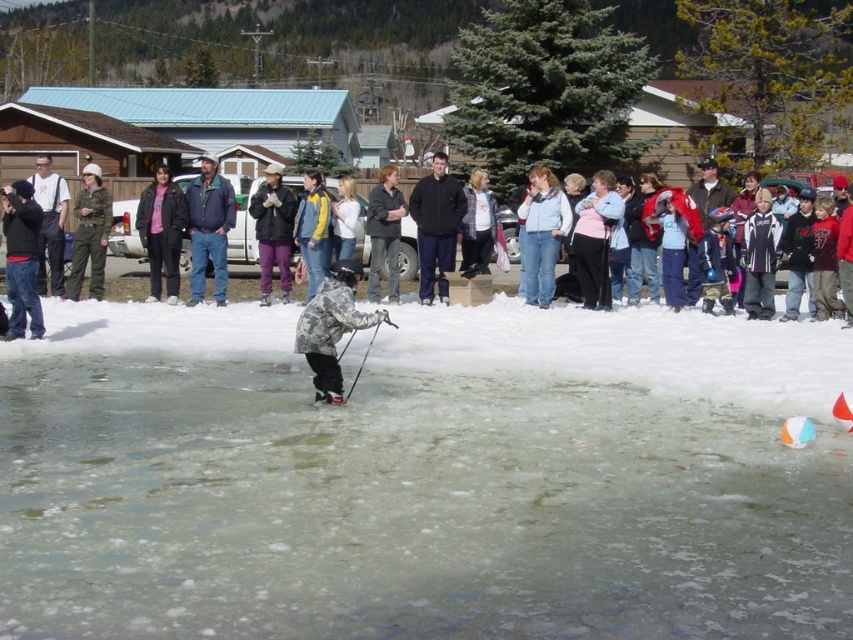
Question: Which object is closer to the camera taking this photo?

Choices:
 (A) dark blue jacket at center
 (B) camouflage snowsuit at center

Answer: (B)

Question: Which of the following is the closest to the observer?

Choices:
 (A) (381, 230)
 (B) (592, 413)

Answer: (B)

Question: Does matte black jacket at center appear on the left side of dark gray jacket at center?

Choices:
 (A) no
 (B) yes

Answer: (B)

Question: Which of the following is the farthest from the observer?

Choices:
 (A) camouflage fabric jacket at center
 (B) dark gray camouflage jacket at left
 (C) dark blue jacket at center

Answer: (A)

Question: Does translucent ice rink at center appear on the right side of camouflage snowsuit at center?

Choices:
 (A) yes
 (B) no

Answer: (A)

Question: Is matte black jacket at center smaller than purple fleece jacket at center?

Choices:
 (A) yes
 (B) no

Answer: (B)